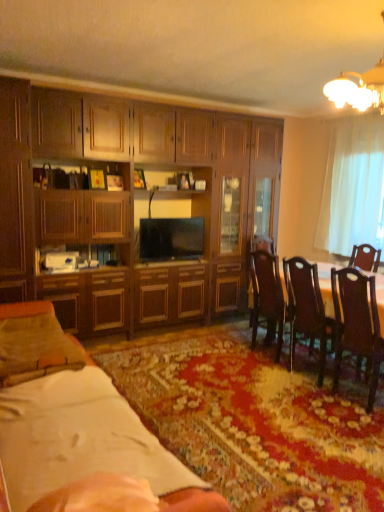
You are a GUI agent. You are given a task and a screenshot of the screen. Output one action in this format:
    pyautogui.click(x=<x>, y=<y>)
    Task: Click on the free point to the left of dark brown wood chair at center right, the second chair viewed from the right
    
    Given the screenshot: What is the action you would take?
    pyautogui.click(x=230, y=357)